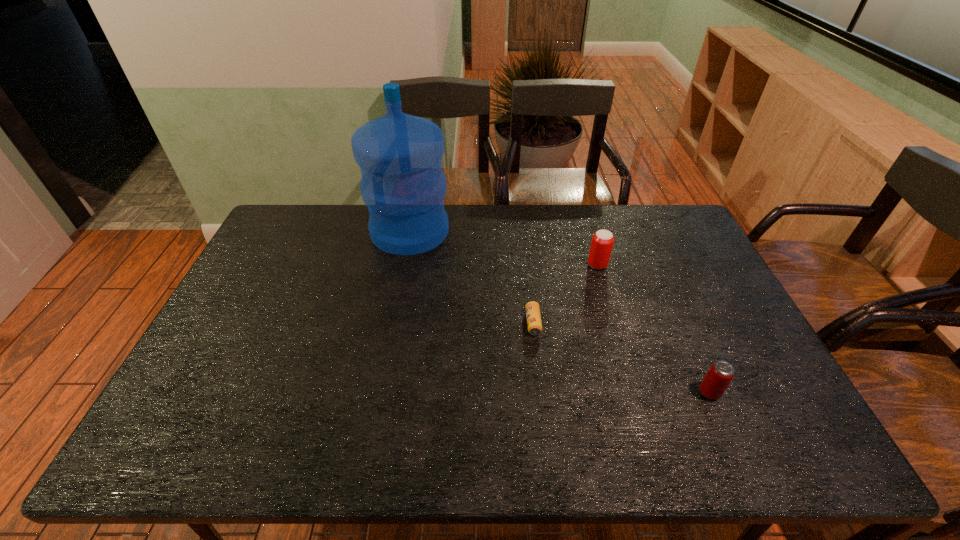
Image resolution: width=960 pixels, height=540 pixels. I want to click on the leftmost object, so click(403, 185).

You are a GUI agent. You are given a task and a screenshot of the screen. Output one action in this format:
    pyautogui.click(x=<x>, y=<y>)
    Task: Click on the farthest object
    
    Given the screenshot: What is the action you would take?
    pyautogui.click(x=403, y=185)

Identify the location of the third nearest object. The width and height of the screenshot is (960, 540). (602, 242).

Identify the location of the second beer can from left to right. (602, 242).

Image resolution: width=960 pixels, height=540 pixels. Find the location of `the rightmost object`. the rightmost object is located at coordinates (720, 374).

The height and width of the screenshot is (540, 960). Identify the location of the nearest object. (720, 374).

The width and height of the screenshot is (960, 540). I want to click on the second nearest beer can, so click(x=534, y=324).

Where is `the leftmost beer can`? The image size is (960, 540). the leftmost beer can is located at coordinates (534, 324).

Where is `vacant space situated 0.110m on the front of the tallest object`? Image resolution: width=960 pixels, height=540 pixels. vacant space situated 0.110m on the front of the tallest object is located at coordinates (400, 279).

Locate an element on the screen. vacant space located 0.280m on the back of the third shortest object is located at coordinates (582, 210).